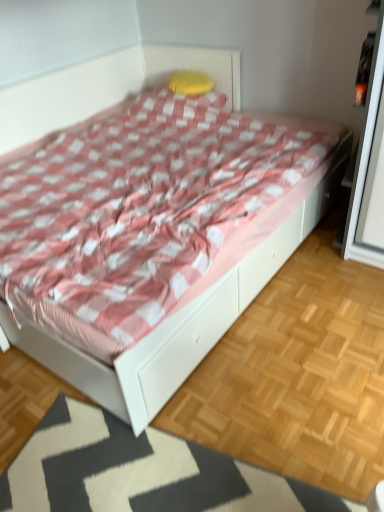
What do you see at coordinates (189, 82) in the screenshot? I see `yellow fabric pillow at upper center` at bounding box center [189, 82].

Image resolution: width=384 pixels, height=512 pixels. Find the location of `white glossy bed at center`. white glossy bed at center is located at coordinates (188, 310).

Identify the location of mat on the right of white glossy bed at center. (141, 472).

Does white glossy bed at center come behind white textured mat at lower center?

That is True.

Looking at this image, would you consider white glossy bed at center to be distant from white textured mat at lower center?

That's not correct — white glossy bed at center is a little close to white textured mat at lower center.

The width and height of the screenshot is (384, 512). In the image, there is a yellow fabric pillow at upper center. In order to click on bed below it (from a real-world perspective) in this screenshot , I will do `click(188, 310)`.

Is yellow fabric pillow at upper center to the left or to the right of white glossy bed at center in the image?

yellow fabric pillow at upper center is to the right of white glossy bed at center.

Is yellow fabric pillow at upper center looking in the opposite direction of white glossy bed at center?

That's right, yellow fabric pillow at upper center is facing away from white glossy bed at center.

From a real-world perspective, is white textured mat at lower center physically located above or below white glossy bed at center?

In terms of real-world spatial position, white textured mat at lower center is below white glossy bed at center.

The image size is (384, 512). I want to click on mat to the right of white glossy bed at center, so click(141, 472).

Who is taller, white textured mat at lower center or white glossy bed at center?

Standing taller between the two is white glossy bed at center.

In the image, is white textured mat at lower center on the left side or the right side of white glossy bed at center?

Based on their positions, white textured mat at lower center is located to the right of white glossy bed at center.

Is white glossy bed at center touching yellow fabric pillow at upper center?

No, white glossy bed at center is not with yellow fabric pillow at upper center.

Locate an element on the screen. pillow that appears above the white glossy bed at center (from a real-world perspective) is located at coordinates (189, 82).

Is white glossy bed at center facing towards yellow fabric pillow at upper center?

No, white glossy bed at center does not turn towards yellow fabric pillow at upper center.

Considering the relative sizes of white glossy bed at center and yellow fabric pillow at upper center in the image provided, is white glossy bed at center bigger than yellow fabric pillow at upper center?

Indeed, white glossy bed at center has a larger size compared to yellow fabric pillow at upper center.

From the picture: Considering the relative positions of yellow fabric pillow at upper center and white textured mat at lower center in the image provided, is yellow fabric pillow at upper center to the left of white textured mat at lower center from the viewer's perspective?

In fact, yellow fabric pillow at upper center is to the right of white textured mat at lower center.

Locate an element on the screen. mat beneath the yellow fabric pillow at upper center (from a real-world perspective) is located at coordinates (141, 472).

Is point (173, 90) closer to viewer compared to point (40, 503)?

No, it is behind (40, 503).

Considering the positions of point (52, 432) and point (177, 84), is point (52, 432) closer or farther from the camera than point (177, 84)?

Point (52, 432) appears to be closer to the viewer than point (177, 84).

From the image's perspective, is white textured mat at lower center over yellow fabric pillow at upper center?

No, from the image's perspective, white textured mat at lower center is not on top of yellow fabric pillow at upper center.

Is white textured mat at lower center wider or thinner than yellow fabric pillow at upper center?

white textured mat at lower center is wider than yellow fabric pillow at upper center.

Is white textured mat at lower center touching yellow fabric pillow at upper center?

No, white textured mat at lower center is not in contact with yellow fabric pillow at upper center.

Where is `mat that appears below the white glossy bed at center (from the image's perspective)`? The height and width of the screenshot is (512, 384). mat that appears below the white glossy bed at center (from the image's perspective) is located at coordinates (141, 472).

What are the coordinates of `bed on the left side of yellow fabric pillow at upper center` in the screenshot? It's located at (188, 310).

Based on their spatial positions, is yellow fabric pillow at upper center or white glossy bed at center further from white textured mat at lower center?

Based on the image, yellow fabric pillow at upper center appears to be further to white textured mat at lower center.

Estimate the real-world distances between objects in this image. Which object is closer to yellow fabric pillow at upper center, white textured mat at lower center or white glossy bed at center?

The object closer to yellow fabric pillow at upper center is white glossy bed at center.

Based on their spatial positions, is yellow fabric pillow at upper center or white textured mat at lower center further from white glossy bed at center?

Based on the image, yellow fabric pillow at upper center appears to be further to white glossy bed at center.

Considering their positions, is white textured mat at lower center positioned closer to white glossy bed at center than yellow fabric pillow at upper center?

white textured mat at lower center lies closer to white glossy bed at center than the other object.

Based on their spatial positions, is white glossy bed at center or yellow fabric pillow at upper center closer to white textured mat at lower center?

Among the two, white glossy bed at center is located nearer to white textured mat at lower center.

From the image, which object appears to be nearer to yellow fabric pillow at upper center, white glossy bed at center or white textured mat at lower center?

white glossy bed at center is positioned closer to the anchor yellow fabric pillow at upper center.

This screenshot has width=384, height=512. I want to click on bed that lies between yellow fabric pillow at upper center and white textured mat at lower center from top to bottom, so click(188, 310).